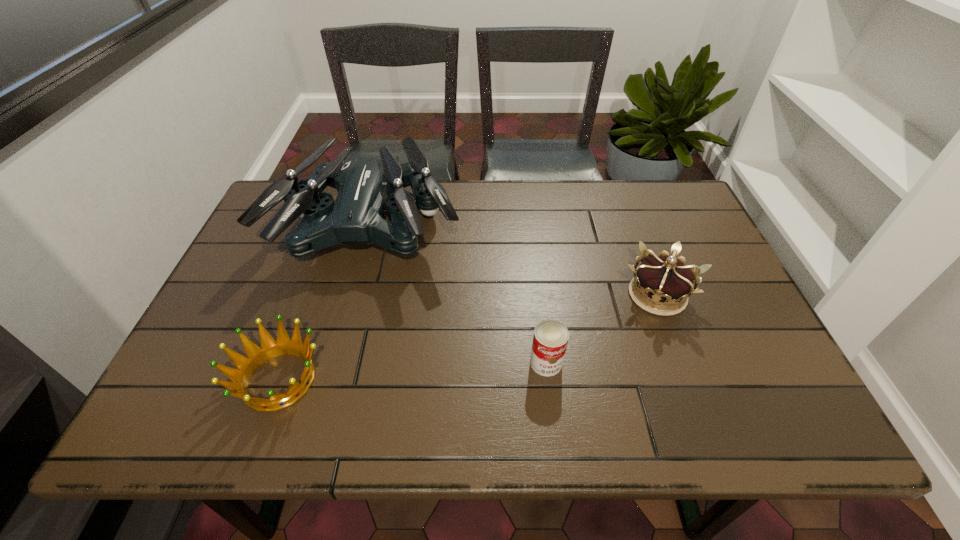
This screenshot has width=960, height=540. What are the coordinates of `free space between the shorter crown and the drone` in the screenshot? It's located at (325, 303).

Identify the location of vacant point located between the tallest object and the right crown. (515, 261).

Where is `empty location between the can and the drone`? empty location between the can and the drone is located at coordinates tap(459, 294).

Where is `empty location between the farther crown and the can`? This screenshot has height=540, width=960. empty location between the farther crown and the can is located at coordinates coord(602,329).

Identify the location of the third closest object to the drone. The width and height of the screenshot is (960, 540). (663, 280).

Identify the location of object that can be found as the second closest to the second object from right to left. This screenshot has height=540, width=960. (365, 182).

In order to click on vacant area in the image that satisfies the following two spatial constraints: 1. on the back side of the third shortest object; 2. on the left side of the shorter crown in this screenshot , I will do `click(309, 295)`.